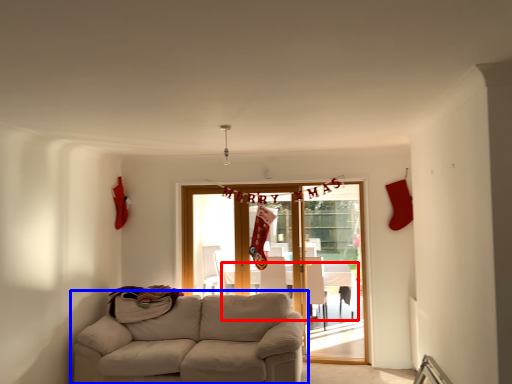
Question: Which point is further to the camera, table (highlighted by a red box) or studio couch (highlighted by a blue box)?

Choices:
 (A) table
 (B) studio couch

Answer: (A)